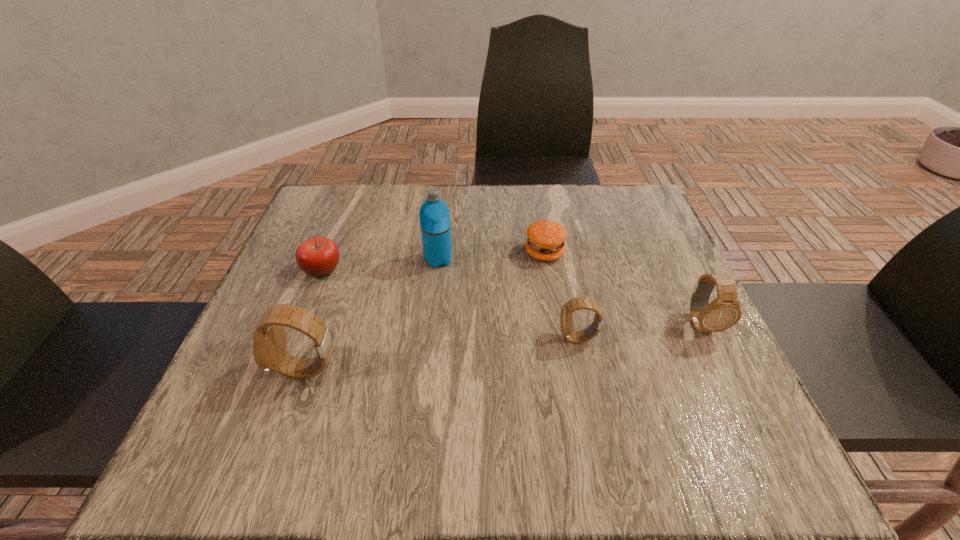
The width and height of the screenshot is (960, 540). In order to click on vacant region that satisfies the following two spatial constraints: 1. on the face of the second tallest watch; 2. on the face of the nearest watch in this screenshot , I will do `click(723, 370)`.